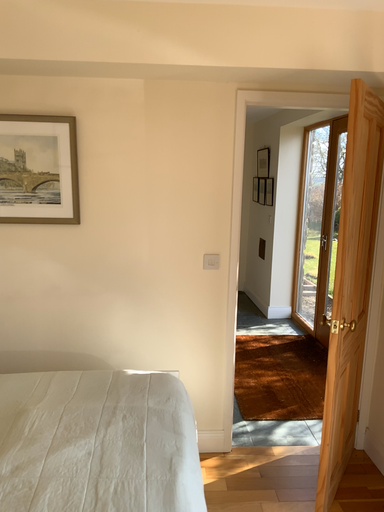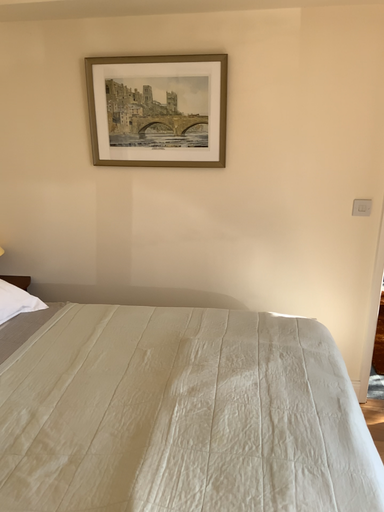
Question: How did the camera likely rotate when shooting the video?

Choices:
 (A) rotated downward
 (B) rotated upward

Answer: (A)